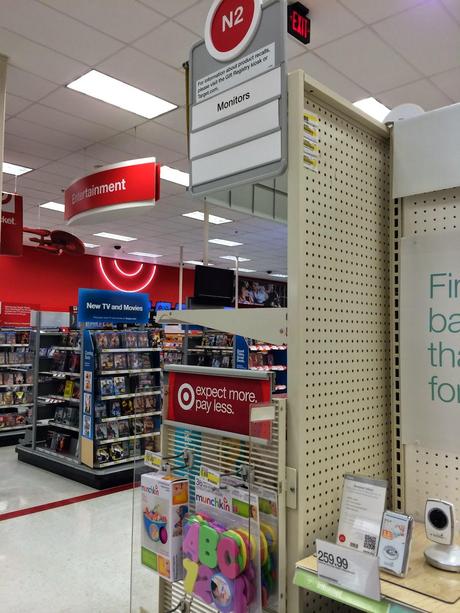
You are a GUI agent. You are given a task and a screenshot of the screen. Output one action in this format:
    pyautogui.click(x=<x>, y=<y>)
    Task: Click on the tv and movie dvd's
    Image resolution: width=460 pixels, height=613 pixels.
    Given the screenshot: What is the action you would take?
    pyautogui.click(x=119, y=384), pyautogui.click(x=121, y=338), pyautogui.click(x=123, y=360), pyautogui.click(x=120, y=405), pyautogui.click(x=118, y=432), pyautogui.click(x=118, y=444)